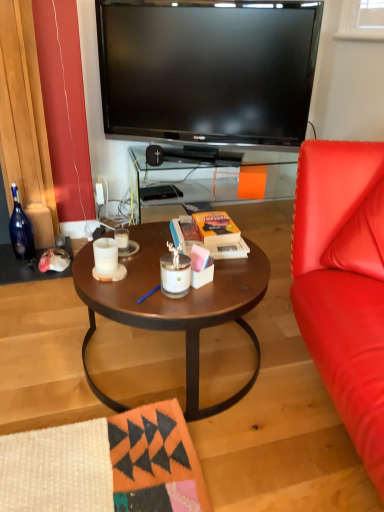
Identify the location of free location to the right of white matte candle at center, which is counted as the 1th coffee cup, starting from the back. This screenshot has width=384, height=512. (152, 245).